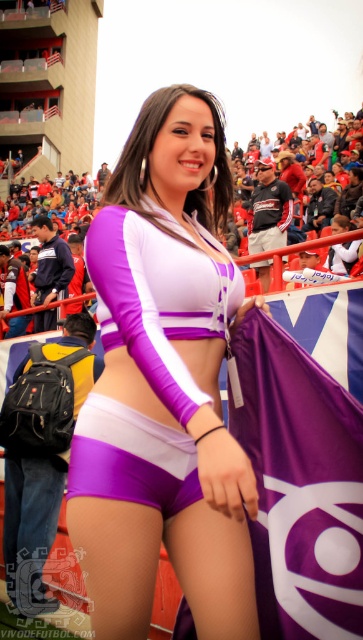
Question: Which object is closer to the camera taking this photo?

Choices:
 (A) purple satin shorts at center
 (B) purple fabric flag at center
 (C) purple matte shorts at center

Answer: (C)

Question: Which object is the closest to the purple matte shorts at center?

Choices:
 (A) purple fabric flag at center
 (B) purple satin shorts at center

Answer: (B)

Question: Which point is farther from the camera taking this photo?

Choices:
 (A) (198, 570)
 (B) (180, 456)

Answer: (B)

Question: Is purple matte shorts at center smaller than purple satin shorts at center?

Choices:
 (A) yes
 (B) no

Answer: (B)

Question: Is purple fabric flag at center smaller than purple satin shorts at center?

Choices:
 (A) no
 (B) yes

Answer: (A)

Question: Observing the image, what is the correct spatial positioning of purple fabric flag at center in reference to purple satin shorts at center?

Choices:
 (A) below
 (B) above

Answer: (A)